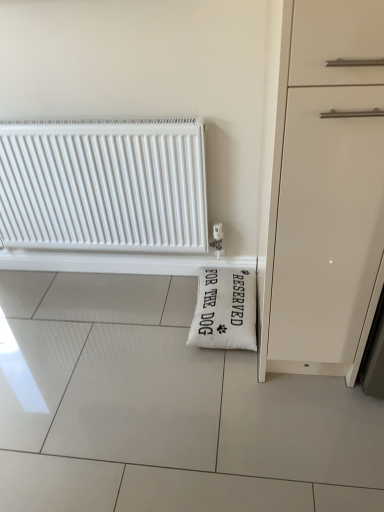
Question: In terms of width, does white plastic radiator at upper left look wider or thinner when compared to white fabric pillow at lower right?

Choices:
 (A) thin
 (B) wide

Answer: (A)

Question: Considering their positions, is white plastic radiator at upper left located in front of or behind white fabric pillow at lower right?

Choices:
 (A) front
 (B) behind

Answer: (A)

Question: Does point (145, 187) appear closer or farther from the camera than point (248, 295)?

Choices:
 (A) closer
 (B) farther

Answer: (A)

Question: Is point (216, 335) positioned closer to the camera than point (173, 230)?

Choices:
 (A) farther
 (B) closer

Answer: (B)

Question: Would you say white fabric pillow at lower right is to the left or to the right of white plastic radiator at upper left in the picture?

Choices:
 (A) right
 (B) left

Answer: (A)

Question: Is white fabric pillow at lower right wider or thinner than white plastic radiator at upper left?

Choices:
 (A) wide
 (B) thin

Answer: (A)

Question: Relative to white plastic radiator at upper left, is white fabric pillow at lower right in front or behind?

Choices:
 (A) behind
 (B) front

Answer: (A)